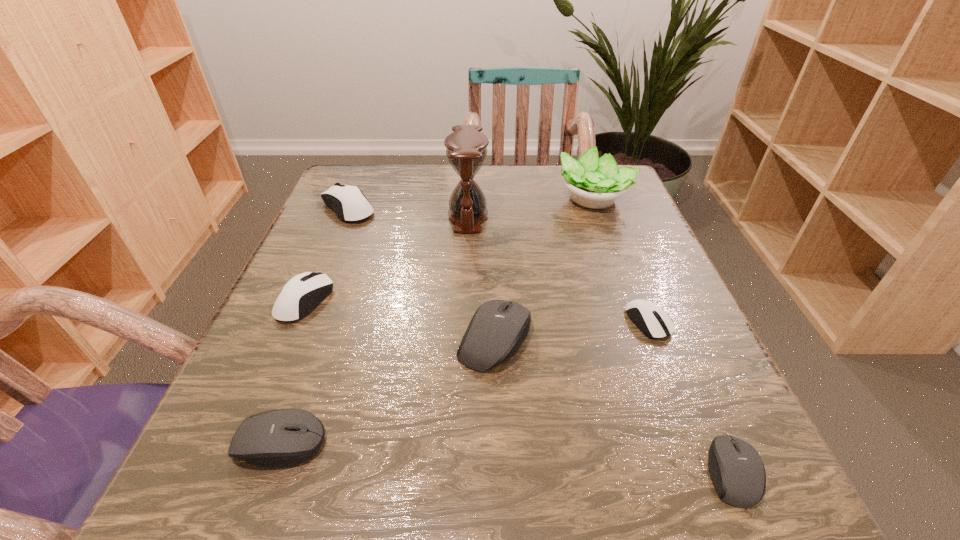
Find the location of a particular element. hourglass at the far edge is located at coordinates (466, 148).

At what (x,y) coordinates should I click in order to perform the action: click on lettuce situated at the far edge. Please return your answer as a coordinate pair (x, y). Looking at the image, I should click on (593, 182).

This screenshot has height=540, width=960. Identify the location of mouse present at the far edge. (348, 202).

Where is `lettuce positioned at the right edge`? This screenshot has height=540, width=960. lettuce positioned at the right edge is located at coordinates (593, 182).

The height and width of the screenshot is (540, 960). What are the coordinates of `object that is positioned at the far left corner` in the screenshot? It's located at (348, 202).

Locate an element on the screen. This screenshot has height=540, width=960. object located in the near left corner section of the desktop is located at coordinates (284, 437).

Where is `object present at the far right corner`? The height and width of the screenshot is (540, 960). object present at the far right corner is located at coordinates (593, 182).

The image size is (960, 540). I want to click on object located in the near right corner section of the desktop, so click(x=736, y=469).

The height and width of the screenshot is (540, 960). In order to click on vacant space at the far edge of the desktop in this screenshot , I will do `click(523, 189)`.

Find the location of a particular element. The width and height of the screenshot is (960, 540). vacant space at the near edge is located at coordinates (442, 456).